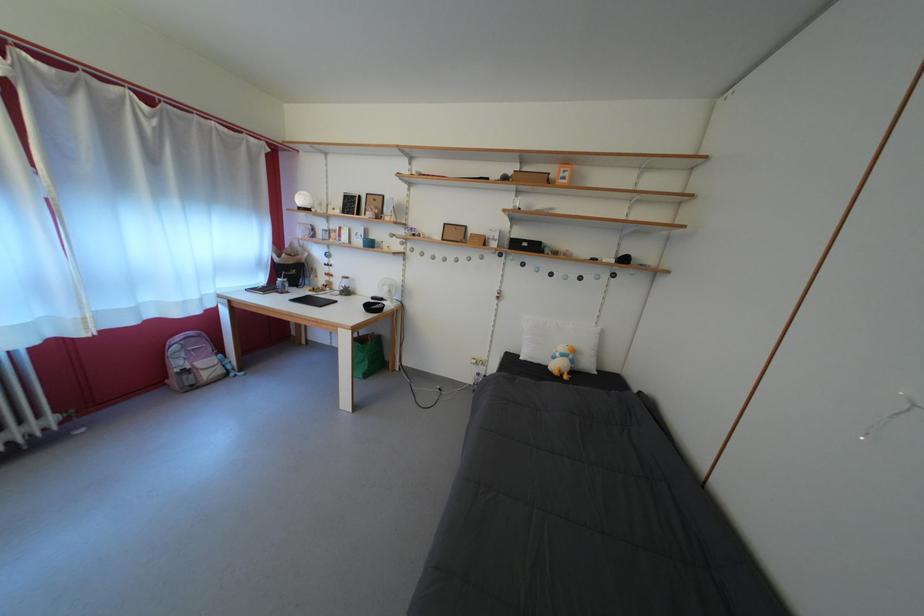
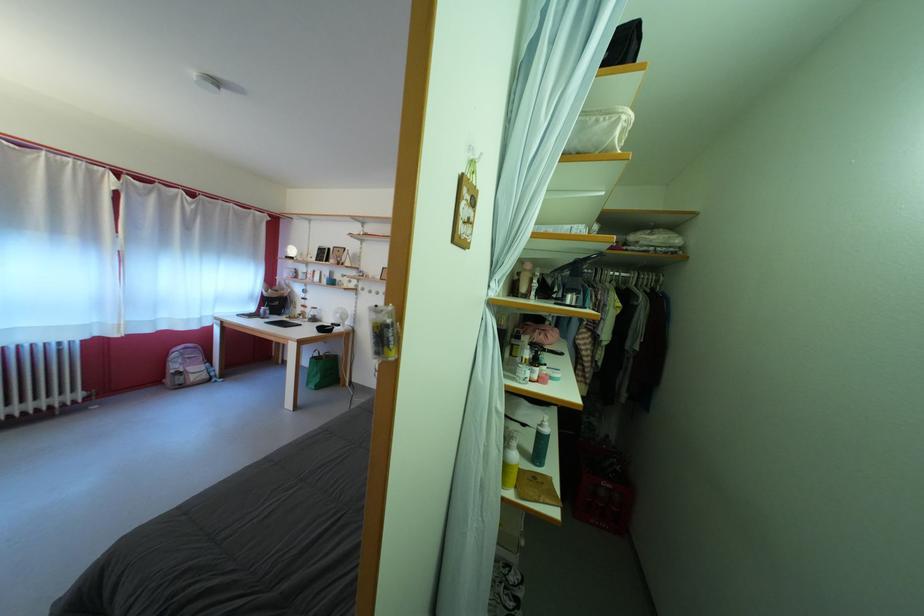
Find the pixel in the second image that matches (x=356, y=299) in the first image.

(322, 325)